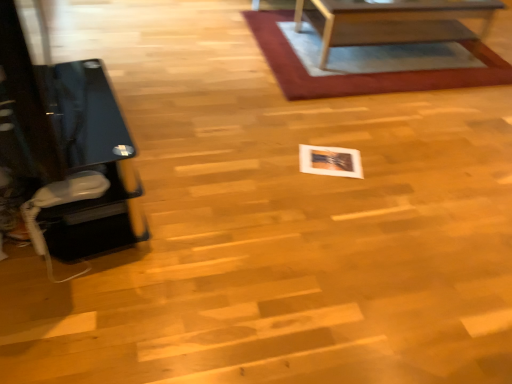
Identify the location of vacant area situated to the left side of white glossy photo frame at center. (278, 156).